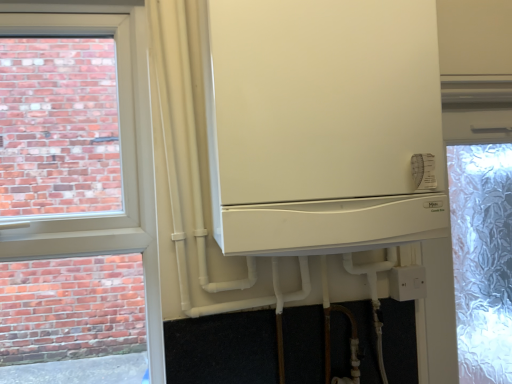
Question: Can you confirm if white matte refrigerator at center is taller than white plastic electric outlet at lower right?

Choices:
 (A) yes
 (B) no

Answer: (A)

Question: From the image's perspective, is white matte refrigerator at center over white plastic electric outlet at lower right?

Choices:
 (A) no
 (B) yes

Answer: (B)

Question: Does white matte refrigerator at center have a lesser width compared to white plastic electric outlet at lower right?

Choices:
 (A) no
 (B) yes

Answer: (A)

Question: From a real-world perspective, is white matte refrigerator at center positioned over white plastic electric outlet at lower right based on gravity?

Choices:
 (A) no
 (B) yes

Answer: (B)

Question: From a real-world perspective, is white matte refrigerator at center under white plastic electric outlet at lower right?

Choices:
 (A) no
 (B) yes

Answer: (A)

Question: Is white matte refrigerator at center oriented towards white plastic electric outlet at lower right?

Choices:
 (A) no
 (B) yes

Answer: (A)

Question: From a real-world perspective, is white plastic electric outlet at lower right located beneath white matte refrigerator at center?

Choices:
 (A) yes
 (B) no

Answer: (A)

Question: Is white matte refrigerator at center completely or partially inside white plastic electric outlet at lower right?

Choices:
 (A) yes
 (B) no

Answer: (B)

Question: Can you confirm if white plastic electric outlet at lower right is bigger than white matte refrigerator at center?

Choices:
 (A) no
 (B) yes

Answer: (A)

Question: Is white plastic electric outlet at lower right not within white matte refrigerator at center?

Choices:
 (A) no
 (B) yes

Answer: (B)

Question: Considering the relative positions of white plastic electric outlet at lower right and white matte refrigerator at center in the image provided, is white plastic electric outlet at lower right in front of white matte refrigerator at center?

Choices:
 (A) no
 (B) yes

Answer: (A)

Question: Is white plastic electric outlet at lower right facing towards white matte refrigerator at center?

Choices:
 (A) yes
 (B) no

Answer: (B)

Question: Relative to white matte refrigerator at center, is white plastic electric outlet at lower right in front or behind?

Choices:
 (A) front
 (B) behind

Answer: (B)